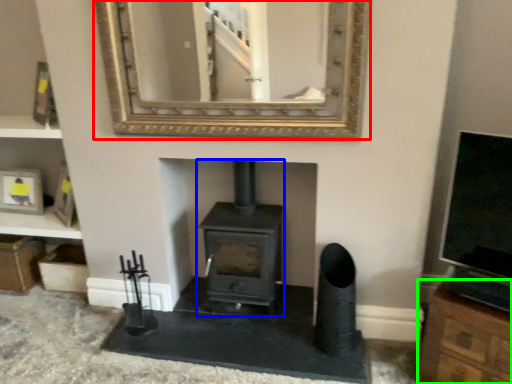
Question: Considering the real-world distances, which object is closest to mirror (highlighted by a red box)? wood burning stove (highlighted by a blue box) or cabinetry (highlighted by a green box).

Choices:
 (A) wood burning stove
 (B) cabinetry

Answer: (A)